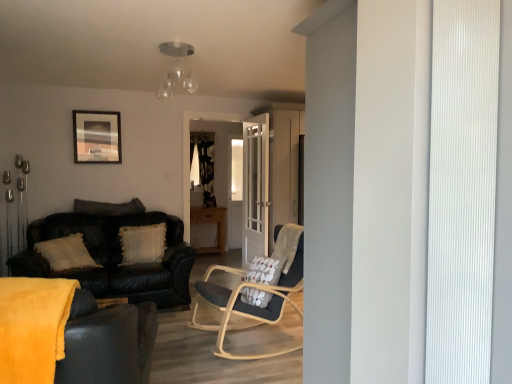
Question: Is the depth of wooden picture frame at upper left greater than that of white textured pillow at left, the first pillow from the top?

Choices:
 (A) yes
 (B) no

Answer: (A)

Question: Is white textured pillow at left, the first pillow from the top, located within wooden picture frame at upper left?

Choices:
 (A) yes
 (B) no

Answer: (B)

Question: From a real-world perspective, is wooden picture frame at upper left located beneath white textured pillow at left, which is counted as the second pillow, starting from the bottom?

Choices:
 (A) no
 (B) yes

Answer: (A)

Question: Is wooden picture frame at upper left to the left of white textured pillow at left, the first pillow from the top, from the viewer's perspective?

Choices:
 (A) yes
 (B) no

Answer: (A)

Question: Is wooden picture frame at upper left to the right of white textured pillow at left, which is counted as the second pillow, starting from the bottom, from the viewer's perspective?

Choices:
 (A) no
 (B) yes

Answer: (A)

Question: In terms of size, does white glossy door at center appear bigger or smaller than velvet dark brown couch at left, the 2th studio couch from the back?

Choices:
 (A) small
 (B) big

Answer: (A)

Question: Relative to velvet dark brown couch at left, the 2th studio couch from the back, is white glossy door at center in front or behind?

Choices:
 (A) front
 (B) behind

Answer: (B)

Question: In the image, is white glossy door at center on the left side or the right side of velvet dark brown couch at left, arranged as the 1th studio couch when viewed from the front?

Choices:
 (A) right
 (B) left

Answer: (A)

Question: Would you say white glossy door at center is inside or outside velvet dark brown couch at left, the 2th studio couch from the back?

Choices:
 (A) outside
 (B) inside

Answer: (A)

Question: In the image, is light brown wooden table at center positioned in front of or behind white textured pillow at center, arranged as the 2th pillow when viewed from the top?

Choices:
 (A) front
 (B) behind

Answer: (B)

Question: From a real-world perspective, is light brown wooden table at center physically located above or below white textured pillow at center, which is the 1th pillow in bottom-to-top order?

Choices:
 (A) below
 (B) above

Answer: (A)

Question: Is light brown wooden table at center inside or outside of white textured pillow at center, which is the 1th pillow in bottom-to-top order?

Choices:
 (A) inside
 (B) outside

Answer: (B)

Question: From their relative heights in the image, would you say light brown wooden table at center is taller or shorter than white textured pillow at center, which is the 1th pillow in bottom-to-top order?

Choices:
 (A) short
 (B) tall

Answer: (B)

Question: Relative to light brown wooden table at center, is white glossy door at center in front or behind?

Choices:
 (A) front
 (B) behind

Answer: (A)

Question: From a real-world perspective, relative to light brown wooden table at center, is white glossy door at center vertically above or below?

Choices:
 (A) below
 (B) above

Answer: (B)